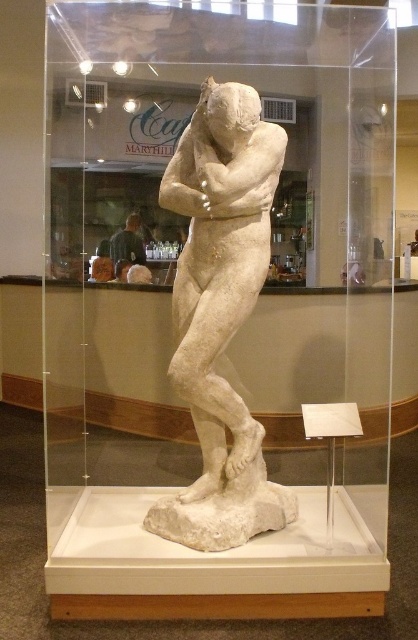
Is white marble statue at center below dark gray shirt at center?

Indeed, white marble statue at center is positioned under dark gray shirt at center.

Does point (242, 170) come in front of point (124, 256)?

Yes, it is.

Is point (234, 518) behind point (134, 262)?

No, it is in front of (134, 262).

The image size is (418, 640). I want to click on white marble statue at center, so click(x=221, y=314).